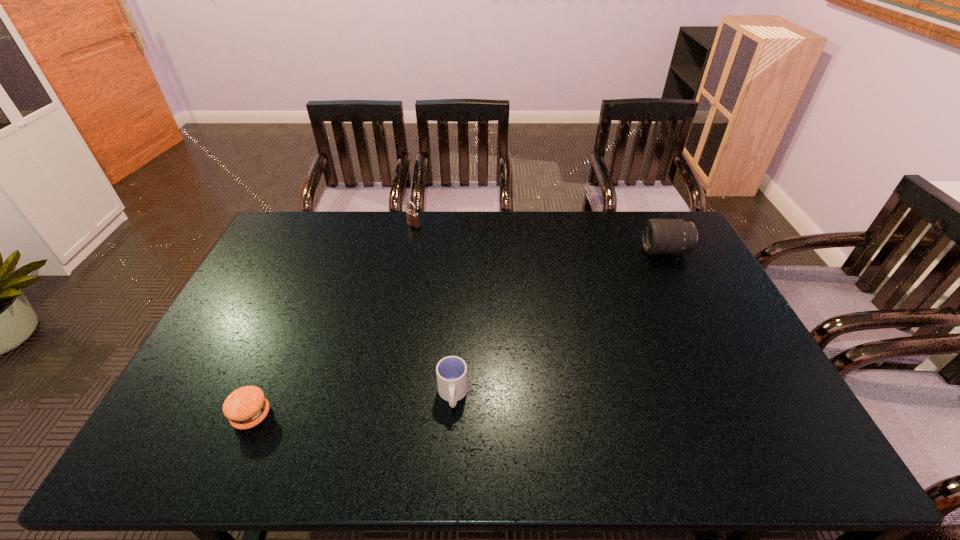
Where is `vacant space situated 0.370m on the surface of the rightmost object`? The image size is (960, 540). vacant space situated 0.370m on the surface of the rightmost object is located at coordinates 540,251.

The height and width of the screenshot is (540, 960). I want to click on vacant region located 0.260m on the left of the second object from left to right, so click(338, 226).

At what (x,y) coordinates should I click in order to perform the action: click on free location located 0.130m with the handle on the side of the cup. Please return your answer as a coordinate pair (x, y). This screenshot has width=960, height=540. Looking at the image, I should click on (449, 466).

Where is `free region located 0.070m on the front of the leftmost object`? free region located 0.070m on the front of the leftmost object is located at coordinates (232, 461).

Where is `telephoto lens that is at the far edge`? The height and width of the screenshot is (540, 960). telephoto lens that is at the far edge is located at coordinates (660, 236).

At what (x,y) coordinates should I click in order to perform the action: click on padlock at the far edge. Please return your answer as a coordinate pair (x, y). The height and width of the screenshot is (540, 960). Looking at the image, I should click on (412, 216).

You are a GUI agent. You are given a task and a screenshot of the screen. Output one action in this format:
    pyautogui.click(x=<x>, y=<y>)
    Task: Click on the object that is positioned at the near edge
    The width and height of the screenshot is (960, 540).
    Given the screenshot: What is the action you would take?
    pyautogui.click(x=246, y=407)

This screenshot has height=540, width=960. What are the coordinates of `object that is positioned at the left edge` in the screenshot? It's located at (246, 407).

I want to click on object present at the right edge, so click(660, 236).

Find the location of a particular element. object located at the near left corner is located at coordinates (246, 407).